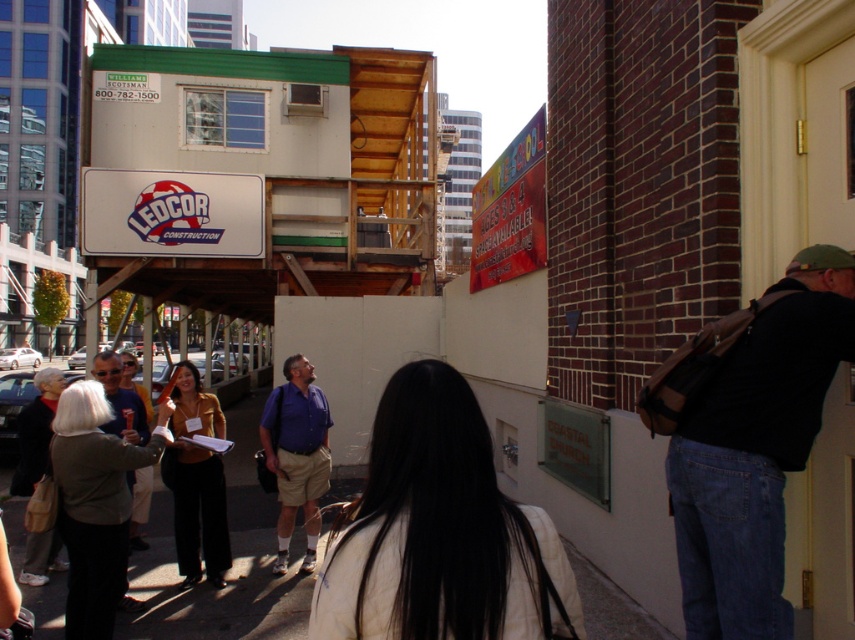
You are a tour guide leading a group near the construction site. You need to move from the smooth concrete pavement at lower center to the black leather backpack at right to retrieve a document. Is the backpack located to the right of the pavement?

The black leather backpack at right is positioned on the right side of the smooth concrete pavement at lower center, so yes, the backpack is located to the right of the pavement.

You are a tour guide leading a group near the construction site. You notice the black leather backpack at right and the blue cotton shirt at center. Which object is smaller in size?

The black leather backpack at right is smaller than the blue cotton shirt at center.

You are a photographer trying to capture a group photo of the people at the construction site. You notice the white matte jacket at center and the blue cotton shirt at center. If you want to ensure both individuals are fully visible in the frame, which person should you position closer to the edge of the frame to avoid cropping?

You should position the white matte jacket at center closer to the edge of the frame because the white matte jacket at center is wider than the blue cotton shirt at center, so it requires more space to be fully visible.